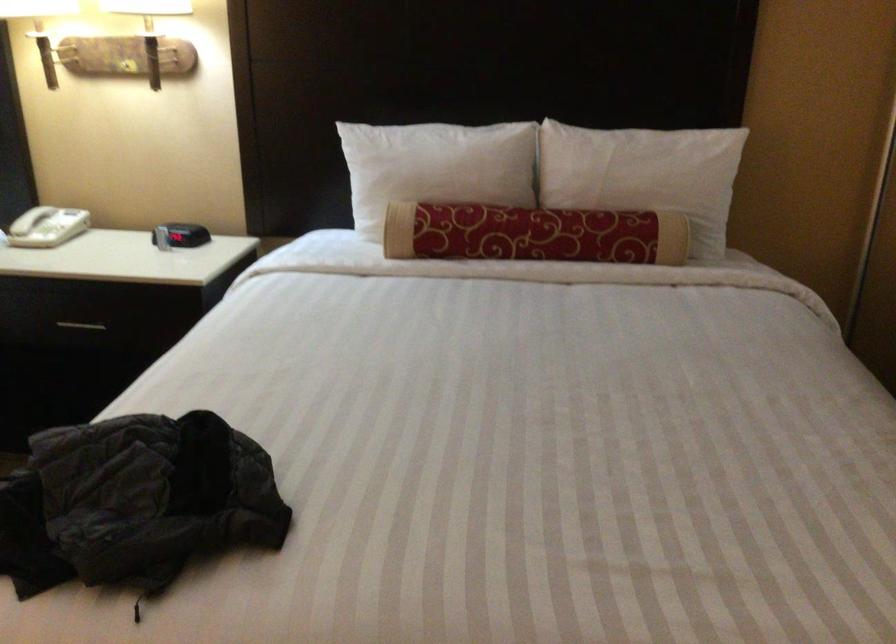
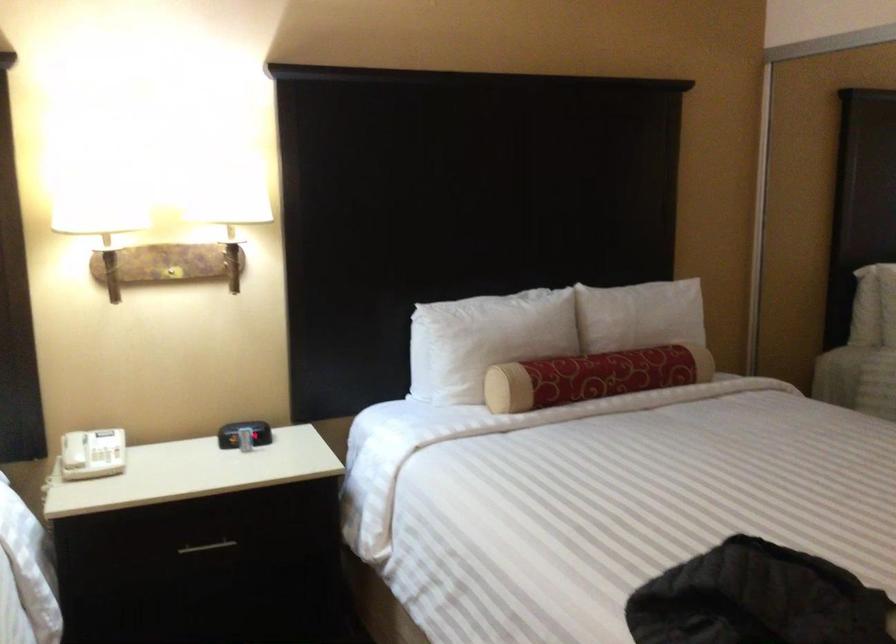
In the second image, find the point that corresponds to (x=158, y=231) in the first image.

(244, 433)